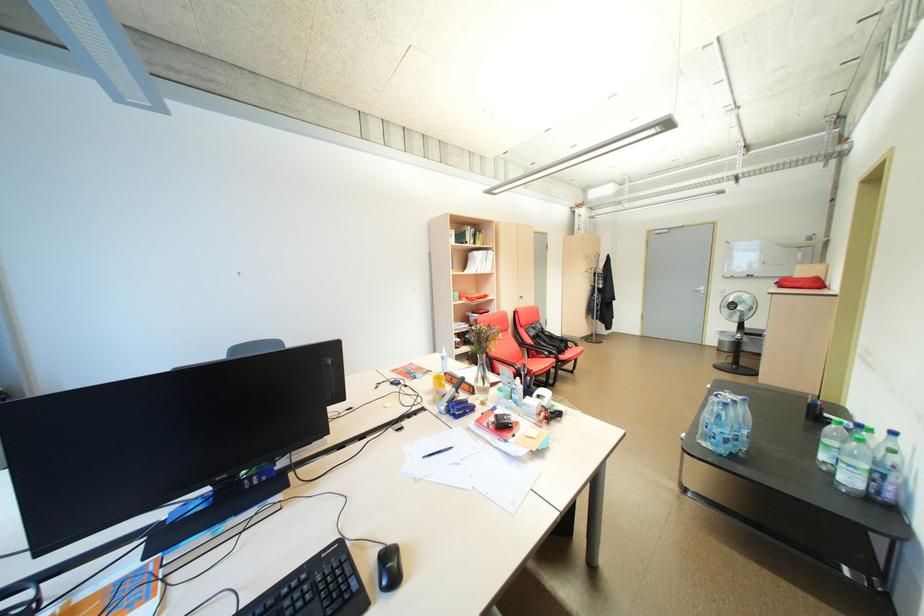
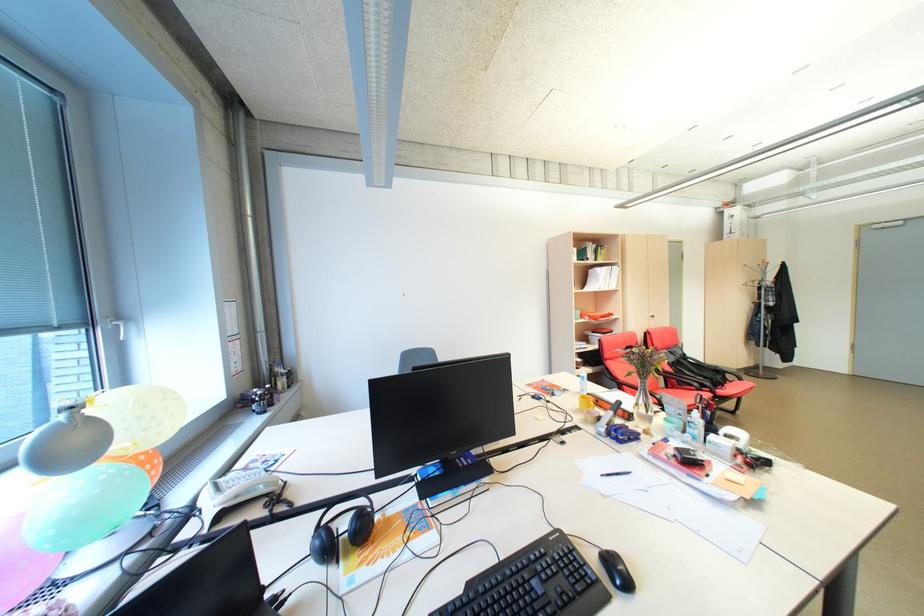
Locate, in the second image, the point that corresponds to pixel 446 398 in the first image.

(600, 418)